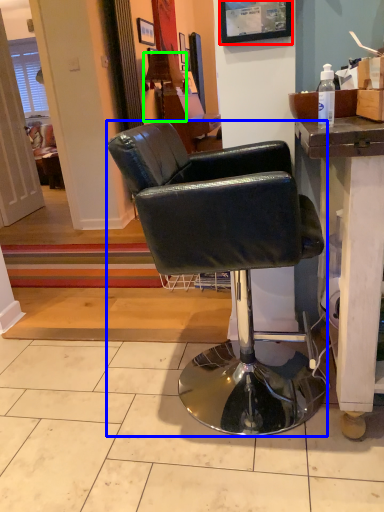
Question: Which is nearer to the picture frame (highlighted by a red box)? chair (highlighted by a blue box) or lamp (highlighted by a green box).

Choices:
 (A) chair
 (B) lamp

Answer: (A)